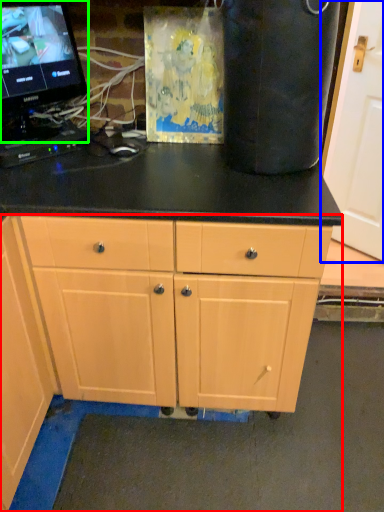
Question: Which is farther away from cabinet (highlighted by a red box)? door (highlighted by a blue box) or computer monitor (highlighted by a green box)?

Choices:
 (A) door
 (B) computer monitor

Answer: (A)